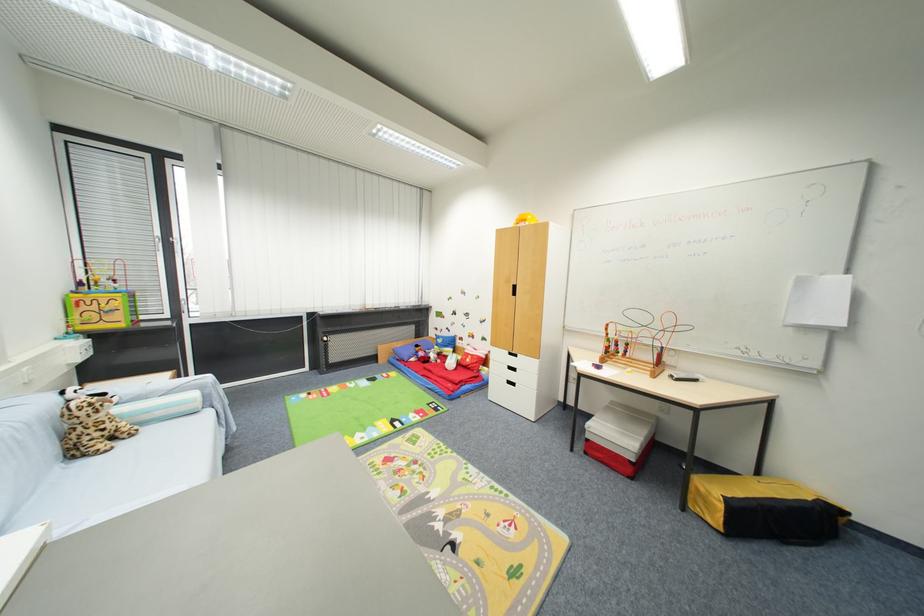
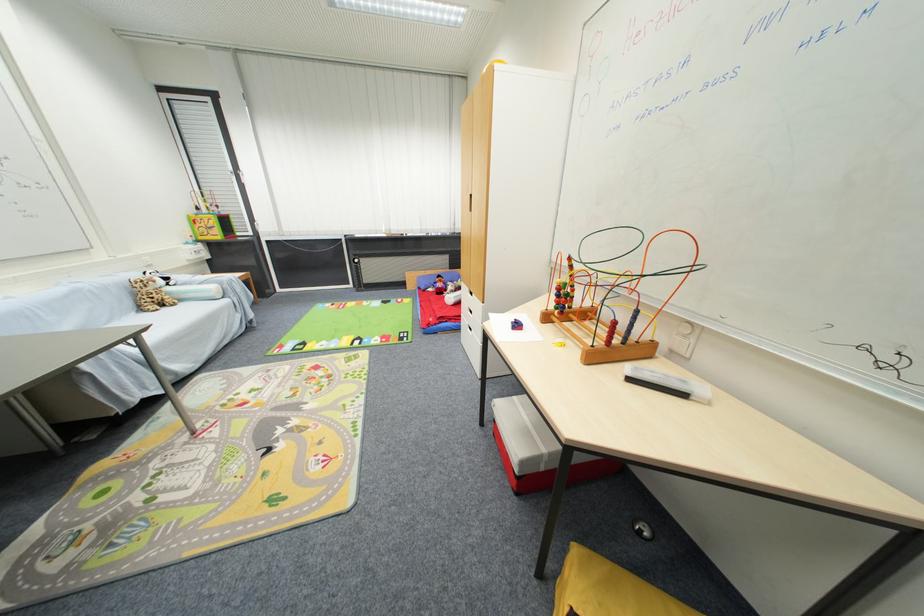
In the second image, find the point that corresponds to [79,456] in the first image.

(146, 310)